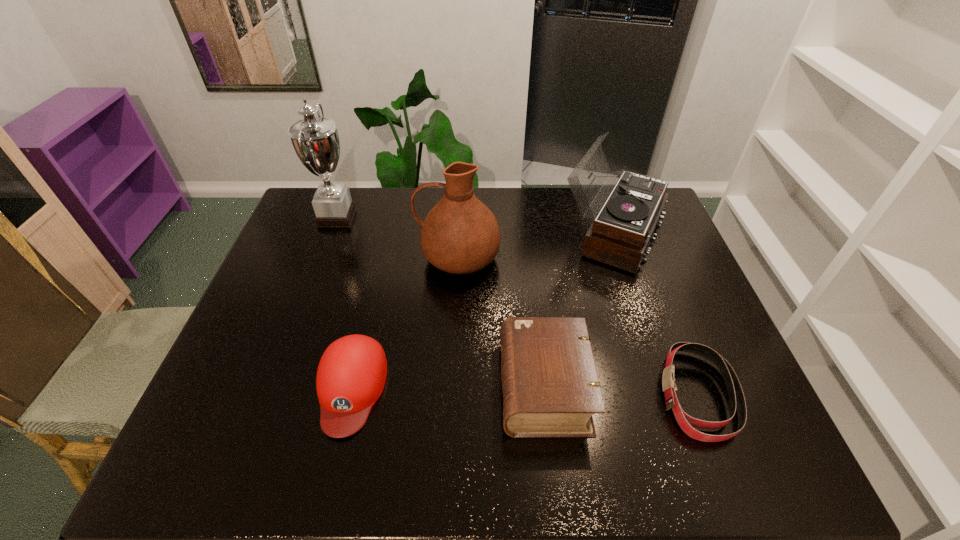
Locate which object is the closest to the record player. Please provide its 2D coordinates. Your answer should be formatted as a tuple, i.e. [(x, y)], where the tuple contains the x and y coordinates of a point satisfying the conditions above.

[(460, 235)]

What are the coordinates of `the second closest object to the trophy cup` in the screenshot? It's located at (351, 375).

Locate an element on the screen. free spot that satisfies the following two spatial constraints: 1. on the front side of the fourth shortest object; 2. on the side of the pitcher with the handle is located at coordinates (621, 258).

Image resolution: width=960 pixels, height=540 pixels. I want to click on free space that satisfies the following two spatial constraints: 1. on the spine side of the Bible; 2. on the front-facing side of the second object from left to right, so click(x=544, y=388).

Where is `free space that satisfies the following two spatial constraints: 1. at the front view of the record player; 2. on the right side of the trophy cup`? free space that satisfies the following two spatial constraints: 1. at the front view of the record player; 2. on the right side of the trophy cup is located at coordinates (330, 234).

Image resolution: width=960 pixels, height=540 pixels. I want to click on vacant point that satisfies the following two spatial constraints: 1. on the front-facing side of the shortest object; 2. on the right side of the baseball cap, so click(x=349, y=394).

Identify the location of blank area in the image that satisfies the following two spatial constraints: 1. on the back side of the shortest object; 2. on the side of the second tallest object with the handle. click(x=644, y=258).